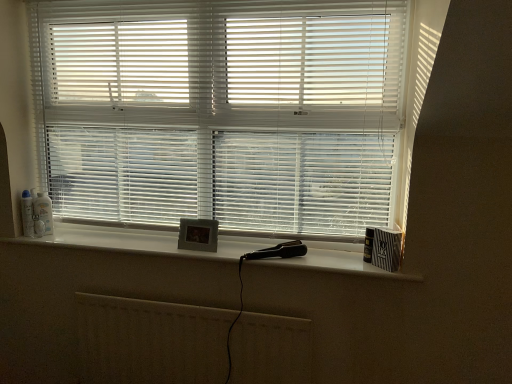
Question: Considering the relative sizes of white matte radiator at lower center and white matte window sill at center in the image provided, is white matte radiator at lower center taller than white matte window sill at center?

Choices:
 (A) no
 (B) yes

Answer: (B)

Question: Does white matte radiator at lower center contain white matte window sill at center?

Choices:
 (A) no
 (B) yes

Answer: (A)

Question: From a real-world perspective, is white matte radiator at lower center positioned over white matte window sill at center based on gravity?

Choices:
 (A) no
 (B) yes

Answer: (A)

Question: From a real-world perspective, is white matte radiator at lower center beneath white matte window sill at center?

Choices:
 (A) yes
 (B) no

Answer: (A)

Question: Is white matte radiator at lower center positioned in front of white matte window sill at center?

Choices:
 (A) no
 (B) yes

Answer: (A)

Question: From the image's perspective, relative to white plastic blinds at center, is white plastic bottle at left, which is the 2th toiletry from left to right, above or below?

Choices:
 (A) below
 (B) above

Answer: (A)

Question: From a real-world perspective, is white plastic bottle at left, the 1th toiletry viewed from the right, physically located above or below white plastic blinds at center?

Choices:
 (A) above
 (B) below

Answer: (B)

Question: Relative to white plastic blinds at center, is white plastic bottle at left, which is the 2th toiletry from left to right, in front or behind?

Choices:
 (A) behind
 (B) front

Answer: (A)

Question: Would you say white plastic bottle at left, the 1th toiletry viewed from the right, is inside or outside white plastic blinds at center?

Choices:
 (A) inside
 (B) outside

Answer: (A)

Question: Which is correct: white matte window sill at center is inside white matte radiator at lower center, or outside of it?

Choices:
 (A) outside
 (B) inside

Answer: (A)

Question: From the image's perspective, is white matte window sill at center located above or below white matte radiator at lower center?

Choices:
 (A) above
 (B) below

Answer: (A)

Question: Does point (31, 243) appear closer or farther from the camera than point (266, 352)?

Choices:
 (A) closer
 (B) farther

Answer: (B)

Question: Is white matte window sill at center bigger or smaller than white matte radiator at lower center?

Choices:
 (A) small
 (B) big

Answer: (A)

Question: Looking at their shapes, would you say white matte window sill at center is wider or thinner than white glossy spray can at left, acting as the 1th toiletry starting from the left?

Choices:
 (A) wide
 (B) thin

Answer: (A)

Question: From the image's perspective, is white matte window sill at center positioned above or below white glossy spray can at left, acting as the 1th toiletry starting from the left?

Choices:
 (A) below
 (B) above

Answer: (A)